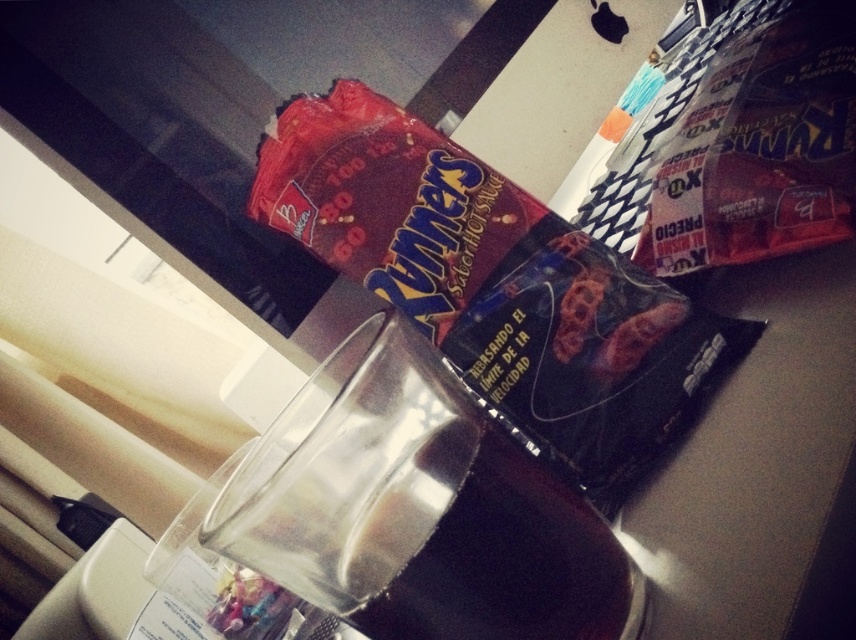
Question: Can you confirm if matte plastic bag of ruffles at upper center is positioned above clear glass beverage at center?

Choices:
 (A) no
 (B) yes

Answer: (B)

Question: Is matte plastic bag of ruffles at upper center positioned before clear glass beverage at center?

Choices:
 (A) no
 (B) yes

Answer: (A)

Question: Is matte plastic bag of ruffles at upper center positioned before clear glass beverage at center?

Choices:
 (A) no
 (B) yes

Answer: (A)

Question: Which point is closer to the camera?

Choices:
 (A) clear glass beverage at center
 (B) matte plastic bag of ruffles at upper center

Answer: (A)

Question: Among these points, which one is farthest from the camera?

Choices:
 (A) (623, 465)
 (B) (330, 444)

Answer: (A)

Question: Which point is farther from the camera taking this photo?

Choices:
 (A) (440, 192)
 (B) (419, 426)

Answer: (A)